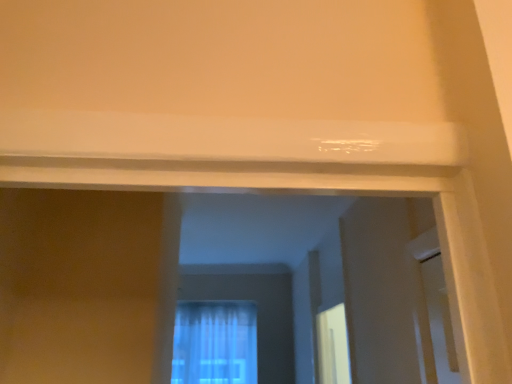
Describe the element at coordinates (215, 342) in the screenshot. I see `blue sheer curtain at center` at that location.

Measure the distance between point (204, 346) and camera.

A distance of 3.78 meters exists between point (204, 346) and camera.

Locate an element on the screen. The image size is (512, 384). blue sheer curtain at center is located at coordinates (215, 342).

You are a GUI agent. You are given a task and a screenshot of the screen. Output one action in this format:
    pyautogui.click(x=<x>, y=<y>)
    Task: Click on the blue sheer curtain at center
    
    Given the screenshot: What is the action you would take?
    pyautogui.click(x=215, y=342)